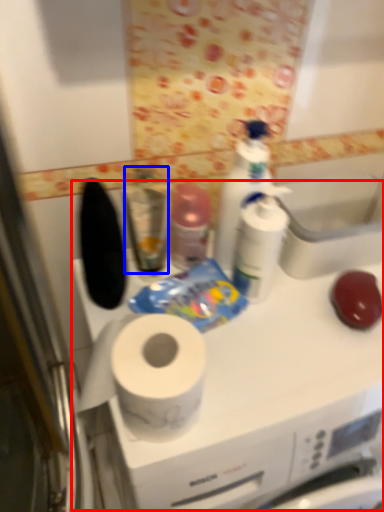
Question: Which object appears farthest to the camera in this image, counter (highlighted by a red box) or mouthwash (highlighted by a blue box)?

Choices:
 (A) counter
 (B) mouthwash

Answer: (B)